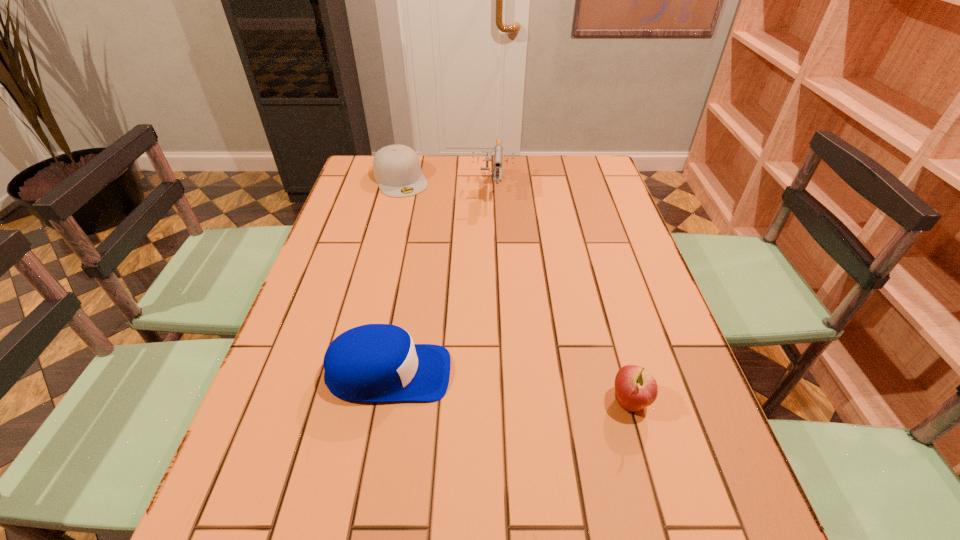
At what (x,y) coordinates should I click in order to perform the action: click on vacant space at the near edge of the desktop. Please return your answer as a coordinate pair (x, y). The width and height of the screenshot is (960, 540). Looking at the image, I should click on (598, 479).

Locate an element on the screen. The width and height of the screenshot is (960, 540). free space at the left edge is located at coordinates (383, 205).

This screenshot has height=540, width=960. In order to click on vacant space at the right edge in this screenshot , I will do `click(643, 308)`.

The width and height of the screenshot is (960, 540). In the image, there is a desktop. Find the location of `vacant area at the far left corner`. vacant area at the far left corner is located at coordinates (363, 177).

Where is `vacant space at the far right corner`? The width and height of the screenshot is (960, 540). vacant space at the far right corner is located at coordinates (601, 163).

This screenshot has width=960, height=540. I want to click on free space between the second object from right to left and the cap, so click(x=446, y=183).

Locate an element on the screen. Image resolution: width=960 pixels, height=540 pixels. vacant region between the apple and the baseball cap is located at coordinates (509, 388).

Where is `free space between the baseball cap and the tallest object`? free space between the baseball cap and the tallest object is located at coordinates (x=441, y=280).

Find the location of a particular element. The image size is (960, 540). unoccupied position between the baseball cap and the rightmost object is located at coordinates (509, 388).

This screenshot has height=540, width=960. Find the location of `vacant area that lies between the baseball cap and the third object from left to right`. vacant area that lies between the baseball cap and the third object from left to right is located at coordinates (441, 280).